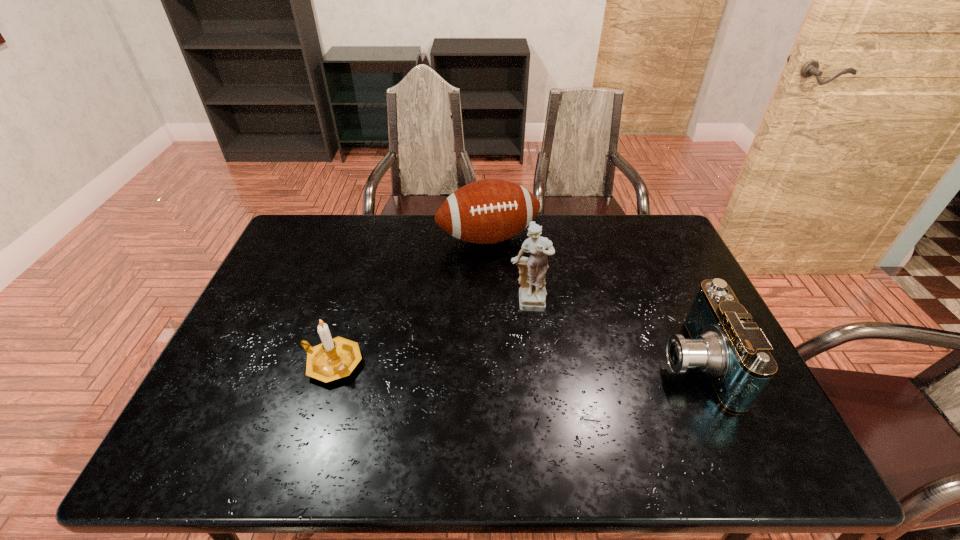
Identify the location of free spot on the desktop that is between the candle holder and the camcorder and is positioned on the laces of the football. (541, 363).

This screenshot has width=960, height=540. Find the location of `vacant space on the desktop that is between the leftmost object and the rightmost object and is positioned on the front-facing side of the figurine`. vacant space on the desktop that is between the leftmost object and the rightmost object and is positioned on the front-facing side of the figurine is located at coordinates (537, 363).